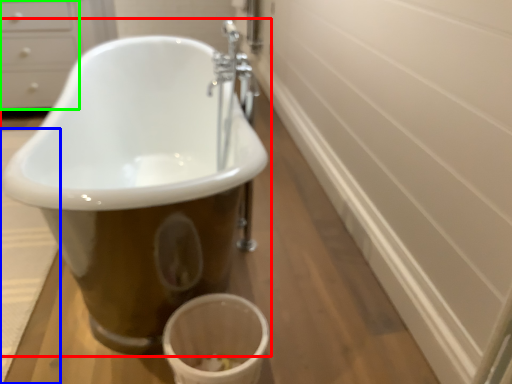
Question: Which object is the closest to the bathtub (highlighted by a red box)? Choose among these: bath mat (highlighted by a blue box) or drawer (highlighted by a green box).

Choices:
 (A) bath mat
 (B) drawer

Answer: (A)